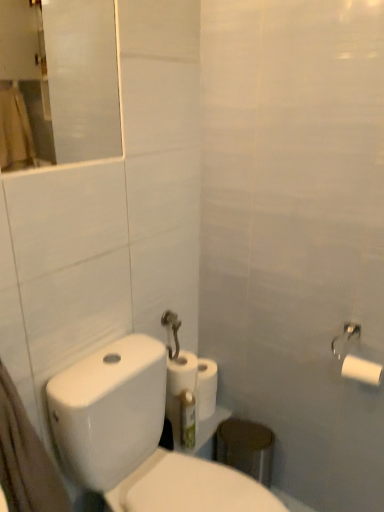
Measure the distance between white matte toilet paper at upper right, placed as the 2th toilet paper when sorted from back to front, and camera.

white matte toilet paper at upper right, placed as the 2th toilet paper when sorted from back to front, is 3.77 feet from camera.

What do you see at coordinates (362, 370) in the screenshot? Image resolution: width=384 pixels, height=512 pixels. I see `white matte toilet paper at upper right, the first toilet paper in the right-to-left sequence` at bounding box center [362, 370].

How much space does white matte toilet paper at right, the first toilet paper viewed from the front, occupy vertically?

It is 2.91 inches.

Measure the distance between point (x=184, y=441) and camera.

Point (x=184, y=441) is 1.50 meters from camera.

The image size is (384, 512). Identify the location of transparent glass mirror at upper left. (60, 81).

Considering the sizes of objects transparent glass mirror at upper left and white glossy toilet at lower left in the image provided, who is taller, transparent glass mirror at upper left or white glossy toilet at lower left?

Standing taller between the two is white glossy toilet at lower left.

Which of these two, transparent glass mirror at upper left or white glossy toilet at lower left, is bigger?

With larger size is white glossy toilet at lower left.

Considering the positions of objects transparent glass mirror at upper left and white glossy toilet at lower left in the image provided, who is more to the left, transparent glass mirror at upper left or white glossy toilet at lower left?

Positioned to the left is transparent glass mirror at upper left.

From a real-world perspective, is white matte toilet paper at right, which is counted as the 2th toilet paper, starting from the left, located higher than white matte toilet paper at upper right, arranged as the 2th toilet paper when viewed from the front?

No, from a real-world perspective, white matte toilet paper at right, which is counted as the 2th toilet paper, starting from the left, is not over white matte toilet paper at upper right, arranged as the 2th toilet paper when viewed from the front

Is white matte toilet paper at right, placed as the 2th toilet paper when sorted from right to left, at the right side of white matte toilet paper at upper right, arranged as the 2th toilet paper when viewed from the front?

No, white matte toilet paper at right, placed as the 2th toilet paper when sorted from right to left, is not to the right of white matte toilet paper at upper right, arranged as the 2th toilet paper when viewed from the front.

Do you think white matte toilet paper at right, placed as the 2th toilet paper when sorted from right to left, is within white matte toilet paper at upper right, the first toilet paper in the right-to-left sequence, or outside of it?

white matte toilet paper at right, placed as the 2th toilet paper when sorted from right to left, exists outside the volume of white matte toilet paper at upper right, the first toilet paper in the right-to-left sequence.

How far apart are white matte toilet paper at right, which is counted as the 2th toilet paper, starting from the left, and white matte toilet paper at upper right, the first toilet paper in the right-to-left sequence?

A distance of 0.83 inches exists between white matte toilet paper at right, which is counted as the 2th toilet paper, starting from the left, and white matte toilet paper at upper right, the first toilet paper in the right-to-left sequence.

How many degrees apart are the facing directions of white glossy toilet at lower left and transparent glass mirror at upper left?

white glossy toilet at lower left and transparent glass mirror at upper left are facing 0.435 degrees away from each other.

Is white glossy toilet at lower left facing towards transparent glass mirror at upper left?

No, white glossy toilet at lower left is not oriented towards transparent glass mirror at upper left.

From a real-world perspective, is white glossy toilet at lower left below transparent glass mirror at upper left?

Yes.

Considering the relative sizes of white matte toilet paper at center, positioned as the third toilet paper in right-to-left order, and green plastic toothbrush at lower center in the image provided, is white matte toilet paper at center, positioned as the third toilet paper in right-to-left order, smaller than green plastic toothbrush at lower center?

Incorrect, white matte toilet paper at center, positioned as the third toilet paper in right-to-left order, is not smaller in size than green plastic toothbrush at lower center.

Looking at this image, from a real-world perspective, which object stands above the other?

white matte toilet paper at center, which is the first toilet paper from back to front.

Is white matte toilet paper at center, which is the first toilet paper from back to front, shorter than green plastic toothbrush at lower center?

Yes.

Considering the relative sizes of white matte toilet paper at center, positioned as the third toilet paper in right-to-left order, and green plastic toothbrush at lower center in the image provided, is white matte toilet paper at center, positioned as the third toilet paper in right-to-left order, wider than green plastic toothbrush at lower center?

Yes.

From the image's perspective, is white matte paper towel at center on top of white matte toilet paper at right, placed as the 2th toilet paper when sorted from right to left?

No.

Is white matte paper towel at center taller or shorter than white matte toilet paper at right, which is counted as the 2th toilet paper, starting from the left?

white matte paper towel at center is taller than white matte toilet paper at right, which is counted as the 2th toilet paper, starting from the left.

Which object is closer to the camera taking this photo, white matte paper towel at center or white matte toilet paper at right, placed as the 2th toilet paper when sorted from right to left?

white matte toilet paper at right, placed as the 2th toilet paper when sorted from right to left.

From a real-world perspective, which is physically below, white matte paper towel at center or white matte toilet paper at right, which is counted as the 2th toilet paper, starting from the left?

From a 3D spatial view, white matte paper towel at center is below.

From the image's perspective, which object appears higher, white matte toilet paper at upper right, arranged as the 2th toilet paper when viewed from the front, or transparent glass mirror at upper left?

transparent glass mirror at upper left is shown above in the image.

Considering their positions, is white matte toilet paper at upper right, placed as the 2th toilet paper when sorted from back to front, located in front of or behind transparent glass mirror at upper left?

In the image, white matte toilet paper at upper right, placed as the 2th toilet paper when sorted from back to front, appears behind transparent glass mirror at upper left.

Locate an element on the screen. The height and width of the screenshot is (512, 384). the 3rd toilet paper to the right of the transparent glass mirror at upper left, starting your count from the anchor is located at coordinates click(x=362, y=370).

Looking at the image, does white matte toilet paper at upper right, the third toilet paper from the left, seem bigger or smaller compared to transparent glass mirror at upper left?

white matte toilet paper at upper right, the third toilet paper from the left, is smaller than transparent glass mirror at upper left.

Could you tell me if green plastic toothbrush at lower center is facing white glossy toilet at lower left?

No, green plastic toothbrush at lower center is not turned towards white glossy toilet at lower left.

How different are the orientations of green plastic toothbrush at lower center and white glossy toilet at lower left in degrees?

They differ by 1.91 degrees in their facing directions.

Find the location of a particular element. toilet on the left of green plastic toothbrush at lower center is located at coordinates (137, 437).

Does green plastic toothbrush at lower center have a greater width compared to white glossy toilet at lower left?

No, green plastic toothbrush at lower center is not wider than white glossy toilet at lower left.

Where is `mirror on the left side of white glossy toilet at lower left`? mirror on the left side of white glossy toilet at lower left is located at coordinates (60, 81).

You are a GUI agent. You are given a task and a screenshot of the screen. Output one action in this format:
    pyautogui.click(x=<x>, y=<y>)
    Task: Click on the 1st toilet paper behind the white matte toilet paper at right, positioned as the 3th toilet paper in back-to-front order
    
    Given the screenshot: What is the action you would take?
    pyautogui.click(x=362, y=370)

Estimate the real-world distances between objects in this image. Which object is further from white glossy toilet at lower left, transparent glass mirror at upper left or white matte toilet paper at right, the first toilet paper viewed from the front?

transparent glass mirror at upper left is further to white glossy toilet at lower left.

Consider the image. When comparing their distances from white glossy toilet at lower left, does white matte toilet paper at right, which is counted as the 2th toilet paper, starting from the left, or green plastic toothbrush at lower center seem further?

Based on the image, white matte toilet paper at right, which is counted as the 2th toilet paper, starting from the left, appears to be further to white glossy toilet at lower left.

When comparing their distances from green plastic toothbrush at lower center, does white matte toilet paper at right, the first toilet paper viewed from the front, or transparent glass mirror at upper left seem closer?

The object closer to green plastic toothbrush at lower center is white matte toilet paper at right, the first toilet paper viewed from the front.

From the image, which object appears to be nearer to white matte paper towel at center, white matte toilet paper at center, the 1th toilet paper from the left, or white matte toilet paper at upper right, the first toilet paper in the right-to-left sequence?

white matte toilet paper at center, the 1th toilet paper from the left, lies closer to white matte paper towel at center than the other object.

When comparing their distances from white matte toilet paper at center, positioned as the third toilet paper in right-to-left order, does green plastic toothbrush at lower center or white matte toilet paper at right, which is counted as the 2th toilet paper, starting from the left, seem closer?

The object closer to white matte toilet paper at center, positioned as the third toilet paper in right-to-left order, is green plastic toothbrush at lower center.

Based on their spatial positions, is white matte paper towel at center or white matte toilet paper at right, which is counted as the 2th toilet paper, starting from the left, further from white glossy toilet at lower left?

Based on the image, white matte toilet paper at right, which is counted as the 2th toilet paper, starting from the left, appears to be further to white glossy toilet at lower left.

Estimate the real-world distances between objects in this image. Which object is closer to transparent glass mirror at upper left, white glossy toilet at lower left or white matte toilet paper at center, which is the first toilet paper from back to front?

white matte toilet paper at center, which is the first toilet paper from back to front.

Based on their spatial positions, is white matte toilet paper at upper right, arranged as the 2th toilet paper when viewed from the front, or green plastic toothbrush at lower center closer to white glossy toilet at lower left?

green plastic toothbrush at lower center lies closer to white glossy toilet at lower left than the other object.

The width and height of the screenshot is (384, 512). In order to click on toilet paper between white matte toilet paper at center, the 3th toilet paper from the front, and white matte toilet paper at upper right, placed as the 2th toilet paper when sorted from back to front, from left to right in this screenshot , I will do `click(362, 370)`.

You are a GUI agent. You are given a task and a screenshot of the screen. Output one action in this format:
    pyautogui.click(x=<x>, y=<y>)
    Task: Click on the toothbrush between transparent glass mirror at upper left and white glossy toilet at lower left in the vertical direction
    Image resolution: width=384 pixels, height=512 pixels.
    Given the screenshot: What is the action you would take?
    pyautogui.click(x=187, y=420)

Locate an element on the screen. The height and width of the screenshot is (512, 384). toilet paper situated between white matte paper towel at center and white matte toilet paper at upper right, the third toilet paper from the left, from left to right is located at coordinates (362, 370).

You are a GUI agent. You are given a task and a screenshot of the screen. Output one action in this format:
    pyautogui.click(x=<x>, y=<y>)
    Task: Click on the paper towel between green plastic toothbrush at lower center and white matte toilet paper at upper right, the third toilet paper from the left, from left to right
    The width and height of the screenshot is (384, 512).
    Given the screenshot: What is the action you would take?
    pyautogui.click(x=193, y=382)